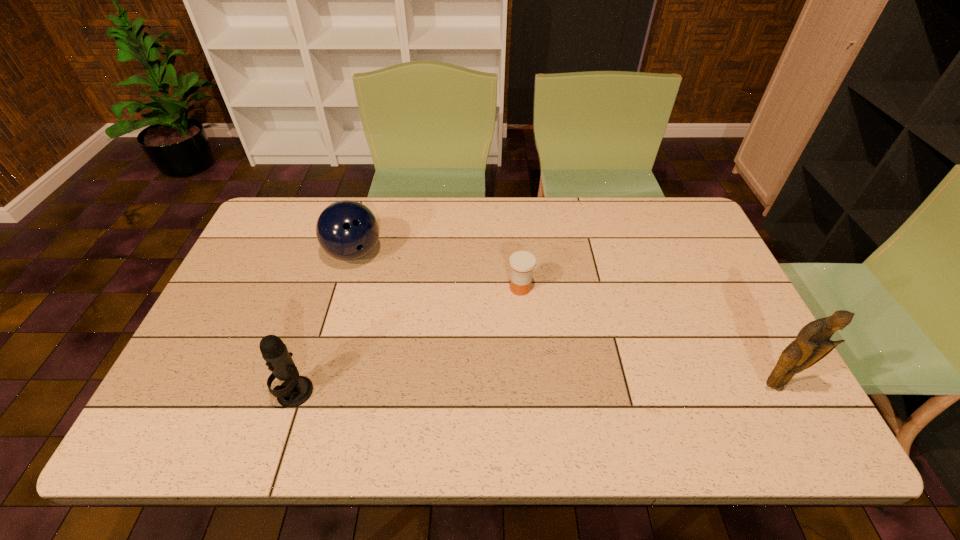
At what (x,y) coordinates should I click in order to perform the action: click on free spot between the microphone and the third object from left to right. Please return your answer as a coordinate pair (x, y). The height and width of the screenshot is (540, 960). Looking at the image, I should click on (408, 340).

The image size is (960, 540). I want to click on unoccupied area between the shortest object and the farthest object, so click(437, 271).

Identify the location of free area in between the microphone and the medicine. The width and height of the screenshot is (960, 540). pos(408,340).

Image resolution: width=960 pixels, height=540 pixels. Find the location of `free space between the farthest object and the microphone`. free space between the farthest object and the microphone is located at coordinates (324, 323).

Choose which object is the second nearest neighbor to the figurine. Please provide its 2D coordinates. Your answer should be formatted as a tuple, i.e. [(x, y)], where the tuple contains the x and y coordinates of a point satisfying the conditions above.

[(347, 230)]

Identify which object is the second nearest to the farthest object. Please provide its 2D coordinates. Your answer should be formatted as a tuple, i.e. [(x, y)], where the tuple contains the x and y coordinates of a point satisfying the conditions above.

[(522, 263)]